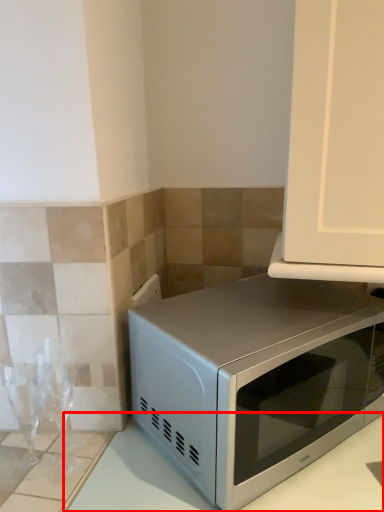
Question: From the image's perspective, what is the correct spatial relationship of counter top (annotated by the red box) in relation to microwave oven?

Choices:
 (A) below
 (B) above

Answer: (A)